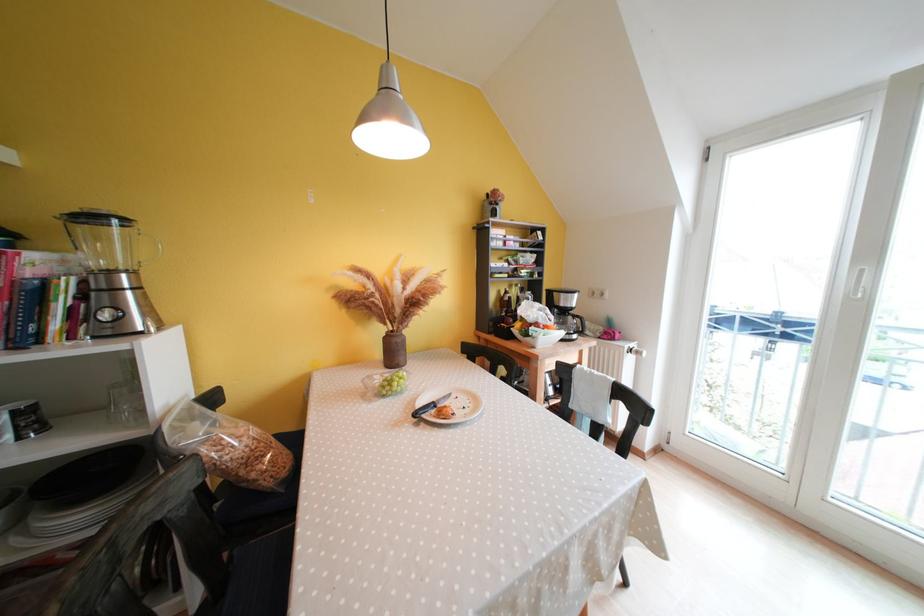
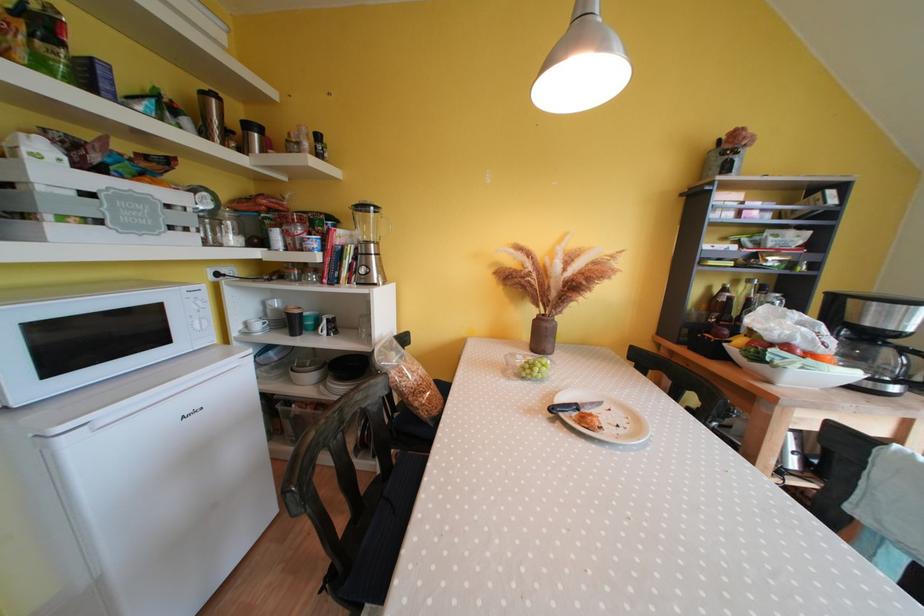
Where in the second image is the point corresponding to the point at 129,280 from the first image?

(379, 249)